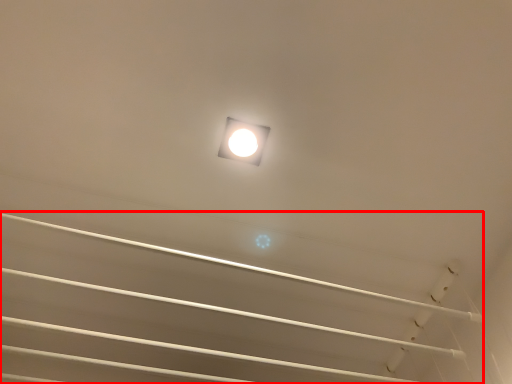
Question: From the image's perspective, where is stairwell (annotated by the red box) located relative to lamp?

Choices:
 (A) above
 (B) below

Answer: (B)